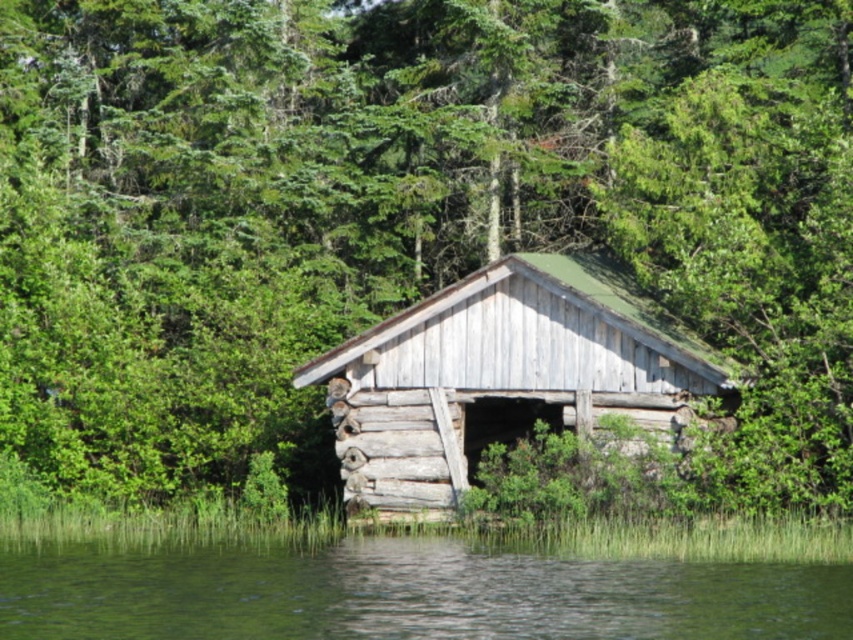
You are standing at the edge of the water and want to cross to the other side. The weathered wood log cabin at center is in your way. Can you walk around the cabin to reach the opposite side of the green liquid water at lower center?

The green liquid water at lower center is wider than the weathered wood log cabin at center, so yes, you can walk around the cabin to reach the opposite side of the green liquid water at lower center since the water spans a greater width than the cabin.

You are standing in front of the rustic wooden structure near the water. There are two points marked on the structure. One is at point (67, 625) and the other is at point (323, 358). Which point is closer to you?

Point (67, 625) is closer to the camera than point (323, 358), so the point at (67, 625) is closer to you.

You are standing at the edge of the water near the boathouse and want to throw a small stone into the green liquid water at lower center. Given that the stone can travel 50 feet, will it reach the water?

The green liquid water at lower center is 49.83 feet from camera, so yes, the stone can reach it since it is within the 50 feet range.